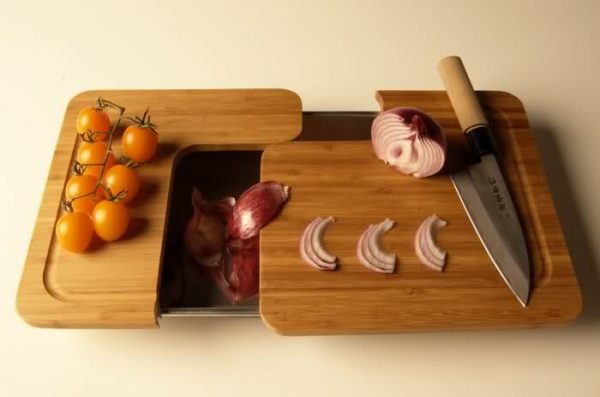
Locate an element on the screen. The image size is (600, 397). knife handle is located at coordinates [x=463, y=87].